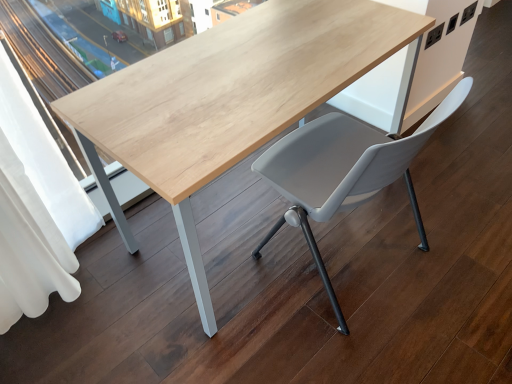
Question: From a real-world perspective, is white fabric curtain at left positioned under natural wood table at center based on gravity?

Choices:
 (A) no
 (B) yes

Answer: (A)

Question: Can you confirm if white fabric curtain at left is shorter than natural wood table at center?

Choices:
 (A) yes
 (B) no

Answer: (B)

Question: Considering the relative sizes of white fabric curtain at left and natural wood table at center in the image provided, is white fabric curtain at left bigger than natural wood table at center?

Choices:
 (A) no
 (B) yes

Answer: (A)

Question: Is the position of white fabric curtain at left less distant than that of natural wood table at center?

Choices:
 (A) no
 (B) yes

Answer: (B)

Question: Is white fabric curtain at left in contact with natural wood table at center?

Choices:
 (A) yes
 (B) no

Answer: (B)

Question: Can natural wood table at center be found inside white fabric curtain at left?

Choices:
 (A) no
 (B) yes

Answer: (A)

Question: Are natural wood table at center and matte gray plastic chair at center beside each other?

Choices:
 (A) no
 (B) yes

Answer: (A)

Question: From a real-world perspective, is natural wood table at center located higher than matte gray plastic chair at center?

Choices:
 (A) yes
 (B) no

Answer: (B)

Question: Is natural wood table at center not near matte gray plastic chair at center?

Choices:
 (A) yes
 (B) no

Answer: (B)

Question: From the image's perspective, is natural wood table at center below matte gray plastic chair at center?

Choices:
 (A) no
 (B) yes

Answer: (A)

Question: Is the depth of natural wood table at center less than that of matte gray plastic chair at center?

Choices:
 (A) no
 (B) yes

Answer: (B)

Question: Is matte gray plastic chair at center at the back of natural wood table at center?

Choices:
 (A) yes
 (B) no

Answer: (B)

Question: Is matte gray plastic chair at center surrounding natural wood table at center?

Choices:
 (A) yes
 (B) no

Answer: (B)